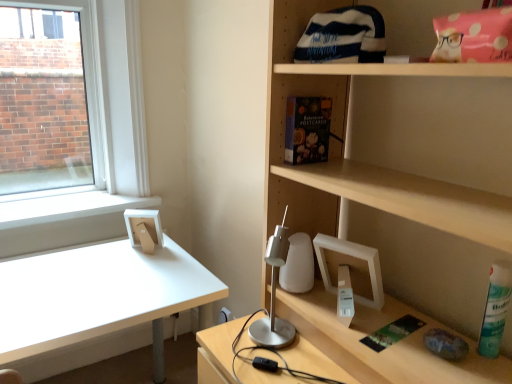
Question: Is green matte spray can at lower right smaller than matte floral-patterned book at upper center?

Choices:
 (A) yes
 (B) no

Answer: (A)

Question: From a real-world perspective, is green matte spray can at lower right over matte floral-patterned book at upper center?

Choices:
 (A) no
 (B) yes

Answer: (A)

Question: Is matte floral-patterned book at upper center at the back of green matte spray can at lower right?

Choices:
 (A) yes
 (B) no

Answer: (B)

Question: Is green matte spray can at lower right wider than matte floral-patterned book at upper center?

Choices:
 (A) no
 (B) yes

Answer: (A)

Question: Is green matte spray can at lower right behind matte floral-patterned book at upper center?

Choices:
 (A) yes
 (B) no

Answer: (B)

Question: Looking at their shapes, would you say green matte spray can at lower right is wider or thinner than matte floral-patterned book at upper center?

Choices:
 (A) wide
 (B) thin

Answer: (B)

Question: Considering the positions of green matte spray can at lower right and matte floral-patterned book at upper center in the image, is green matte spray can at lower right taller or shorter than matte floral-patterned book at upper center?

Choices:
 (A) short
 (B) tall

Answer: (B)

Question: From a real-world perspective, is green matte spray can at lower right positioned above or below matte floral-patterned book at upper center?

Choices:
 (A) above
 (B) below

Answer: (B)

Question: Is green matte spray can at lower right in front of or behind matte floral-patterned book at upper center in the image?

Choices:
 (A) behind
 (B) front

Answer: (B)

Question: Relative to white matte desk at left, is matte floral-patterned book at upper center in front or behind?

Choices:
 (A) front
 (B) behind

Answer: (A)

Question: Is matte floral-patterned book at upper center inside or outside of white matte desk at left?

Choices:
 (A) inside
 (B) outside

Answer: (B)

Question: Is matte floral-patterned book at upper center taller or shorter than white matte desk at left?

Choices:
 (A) short
 (B) tall

Answer: (A)

Question: In the image, is matte floral-patterned book at upper center on the left side or the right side of white matte desk at left?

Choices:
 (A) right
 (B) left

Answer: (A)

Question: From the image's perspective, is green matte spray can at lower right positioned above or below white matte desk at left?

Choices:
 (A) below
 (B) above

Answer: (B)

Question: In terms of size, does green matte spray can at lower right appear bigger or smaller than white matte desk at left?

Choices:
 (A) big
 (B) small

Answer: (B)